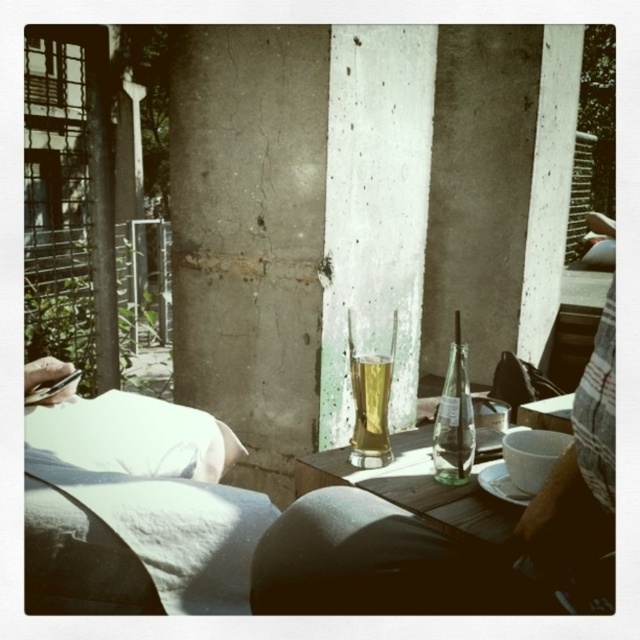
Who is taller, clear glass table at center or translucent glass beer at center?

translucent glass beer at center

What are the coordinates of `clear glass table at center` in the screenshot? It's located at [x=416, y=488].

Can you confirm if clear glass beer at center is positioned above translucent glass beer at center?

Incorrect, clear glass beer at center is not positioned above translucent glass beer at center.

Between point (276, 589) and point (364, 460), which one is positioned in front?

Point (276, 589) is more forward.

Locate an element on the screen. clear glass beer at center is located at coordinates (456, 540).

Where is `clear glass beer at center`? The image size is (640, 640). clear glass beer at center is located at coordinates (456, 540).

Is point (448, 456) farther from viewer compared to point (385, 376)?

No, it is in front of (385, 376).

Is clear glass bottle at center bigger than translucent glass beer at center?

Yes, clear glass bottle at center is bigger than translucent glass beer at center.

Between point (445, 396) and point (353, 356), which one is positioned in front?

Point (445, 396)

At what (x,y) coordinates should I click in order to perform the action: click on clear glass bottle at center. Please return your answer as a coordinate pair (x, y). The height and width of the screenshot is (640, 640). Looking at the image, I should click on (452, 422).